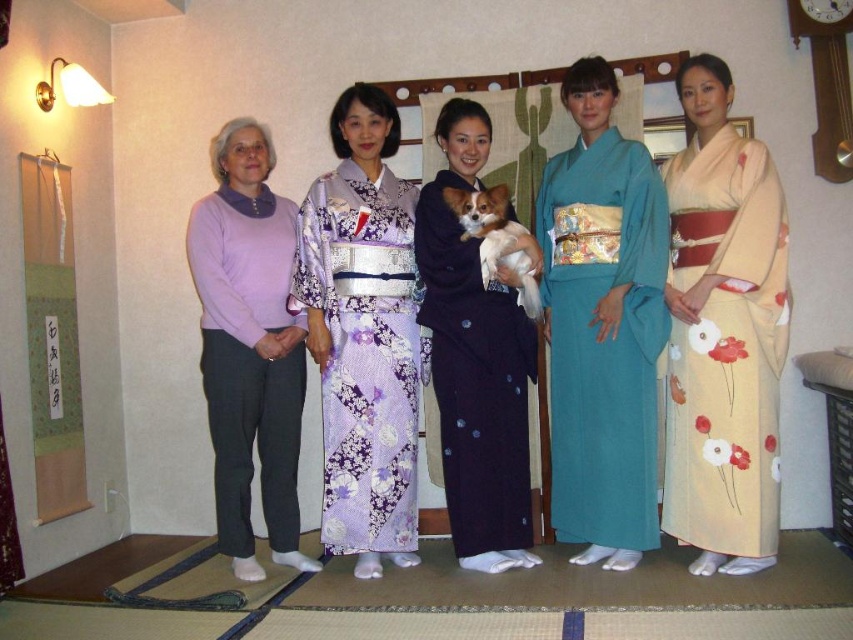
You are a photographer trying to capture a group photo of the teal silk kimono at center and the beige silk kimono at right. Based on their positions, which kimono is positioned higher in the frame?

The teal silk kimono at center is positioned higher in the frame than the beige silk kimono at right.

You are a photographer arranging a group of people in a traditional Japanese room. You notice the lavender floral kimono at center and the purple sweater at left. Which clothing item is covering the other?

The lavender floral kimono at center is positioned over the purple sweater at left, so it is covering the sweater.

You are a photographer arranging a group photo. You have two kimonos in the scene, the beige silk kimono at right and the dark blue kimono at center. Which kimono is bigger in size?

The beige silk kimono at right is larger in size compared to the dark blue kimono at center.